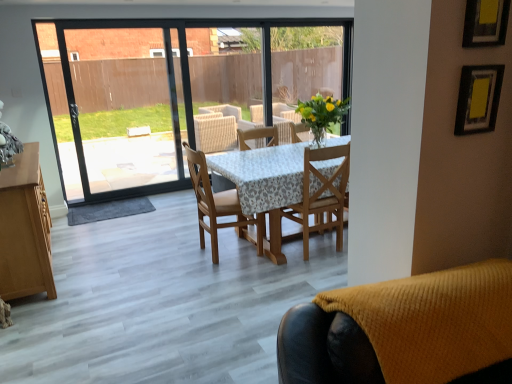
Question: Is knitted yellow chair at lower right, which is the first chair from front to back, not near wooden chair at center, the third chair positioned from the front?

Choices:
 (A) yes
 (B) no

Answer: (A)

Question: From a real-world perspective, is knitted yellow chair at lower right, which is the first chair from front to back, on wooden chair at center, which ranks as the first chair in back-to-front order?

Choices:
 (A) no
 (B) yes

Answer: (B)

Question: Can you confirm if knitted yellow chair at lower right, the 3th chair from the back, is positioned to the left of wooden chair at center, the third chair positioned from the front?

Choices:
 (A) no
 (B) yes

Answer: (A)

Question: From a real-world perspective, does knitted yellow chair at lower right, which is the first chair from front to back, sit lower than wooden chair at center, the third chair positioned from the front?

Choices:
 (A) no
 (B) yes

Answer: (A)

Question: Is knitted yellow chair at lower right, the 3th chair from the back, in contact with wooden chair at center, which ranks as the first chair in back-to-front order?

Choices:
 (A) no
 (B) yes

Answer: (A)

Question: From the image's perspective, is wooden chair at center, which ranks as the first chair in back-to-front order, positioned above or below knitted yellow chair at lower right, the 3th chair from the back?

Choices:
 (A) below
 (B) above

Answer: (B)

Question: Is wooden chair at center, which ranks as the first chair in back-to-front order, in front of or behind knitted yellow chair at lower right, the 3th chair from the back, in the image?

Choices:
 (A) front
 (B) behind

Answer: (B)

Question: Is wooden chair at center, which ranks as the first chair in back-to-front order, inside the boundaries of knitted yellow chair at lower right, the 3th chair from the back, or outside?

Choices:
 (A) outside
 (B) inside

Answer: (A)

Question: From a real-world perspective, relative to knitted yellow chair at lower right, the 3th chair from the back, is wooden chair at center, the third chair positioned from the front, vertically above or below?

Choices:
 (A) above
 (B) below

Answer: (B)

Question: From the image's perspective, relative to wooden chair at center, the third chair positioned from the front, is knitted yellow chair at lower right, which is the first chair from front to back, above or below?

Choices:
 (A) below
 (B) above

Answer: (A)

Question: Is knitted yellow chair at lower right, the 3th chair from the back, bigger or smaller than wooden chair at center, the third chair positioned from the front?

Choices:
 (A) small
 (B) big

Answer: (A)

Question: Considering the relative positions of knitted yellow chair at lower right, the 3th chair from the back, and wooden chair at center, the third chair positioned from the front, in the image provided, is knitted yellow chair at lower right, the 3th chair from the back, to the left or to the right of wooden chair at center, the third chair positioned from the front,?

Choices:
 (A) left
 (B) right

Answer: (B)

Question: Choose the correct answer: Is knitted yellow chair at lower right, the 3th chair from the back, inside wooden chair at center, the third chair positioned from the front, or outside it?

Choices:
 (A) outside
 (B) inside

Answer: (A)

Question: From the image's perspective, is wooden chair at center, which is the 2th chair in front-to-back order, positioned above or below wooden chair at center, which ranks as the first chair in back-to-front order?

Choices:
 (A) above
 (B) below

Answer: (A)

Question: Is wooden chair at center, which is the 2th chair in front-to-back order, in front of or behind wooden chair at center, which ranks as the first chair in back-to-front order, in the image?

Choices:
 (A) behind
 (B) front

Answer: (B)